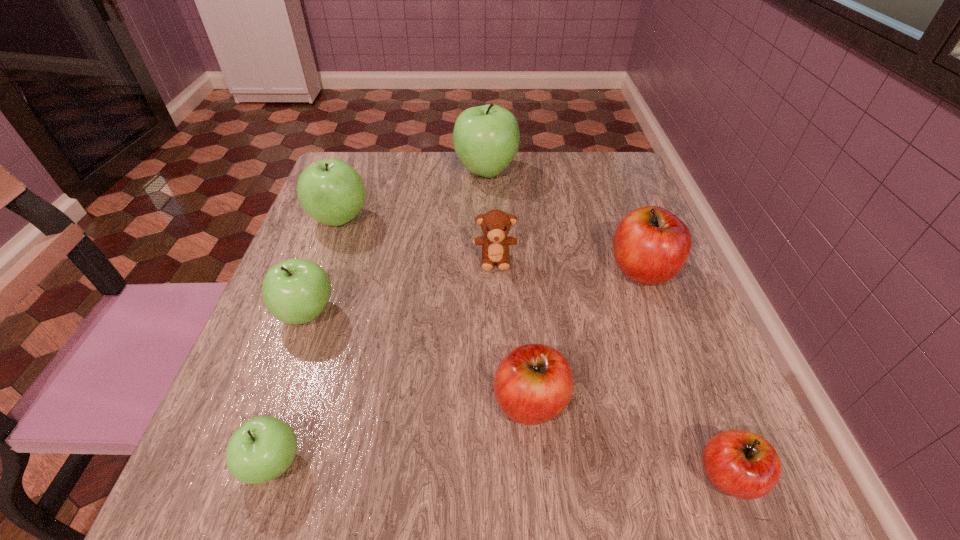
Image resolution: width=960 pixels, height=540 pixels. I want to click on the farthest apple, so click(x=486, y=138).

I want to click on the biggest green apple, so [486, 138].

At what (x,y) coordinates should I click in order to perform the action: click on the seventh nearest object. Please return your answer as a coordinate pair (x, y). Looking at the image, I should click on (330, 191).

You are a GUI agent. You are given a task and a screenshot of the screen. Output one action in this format:
    pyautogui.click(x=<x>, y=<y>)
    Task: Click on the second biggest green apple
    This screenshot has height=540, width=960.
    Given the screenshot: What is the action you would take?
    pyautogui.click(x=330, y=191)

This screenshot has height=540, width=960. I want to click on the farthest red apple, so click(651, 245).

At what (x,y) coordinates should I click in order to perform the action: click on the third farthest green apple. Please return your answer as a coordinate pair (x, y). The image size is (960, 540). Looking at the image, I should click on (296, 291).

What are the coordinates of `the leftmost red apple` in the screenshot? It's located at (533, 383).

Locate an element on the screen. Image resolution: width=960 pixels, height=540 pixels. the second farthest red apple is located at coordinates (533, 383).

Image resolution: width=960 pixels, height=540 pixels. In order to click on brown teddy bear in this screenshot , I will do `click(495, 224)`.

Locate an element on the screen. This screenshot has width=960, height=540. the smallest green apple is located at coordinates (263, 448).